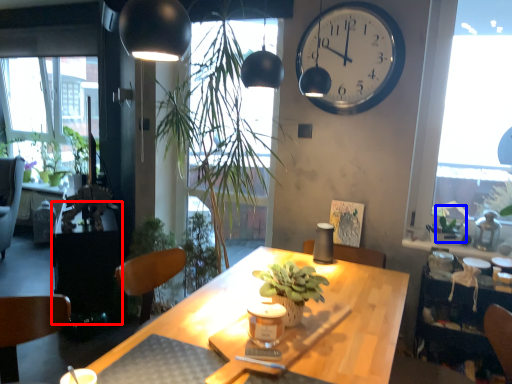
Question: Among these objects, which one is nearest to the camera, table (highlighted by a red box) or plant (highlighted by a blue box)?

Choices:
 (A) table
 (B) plant

Answer: (B)